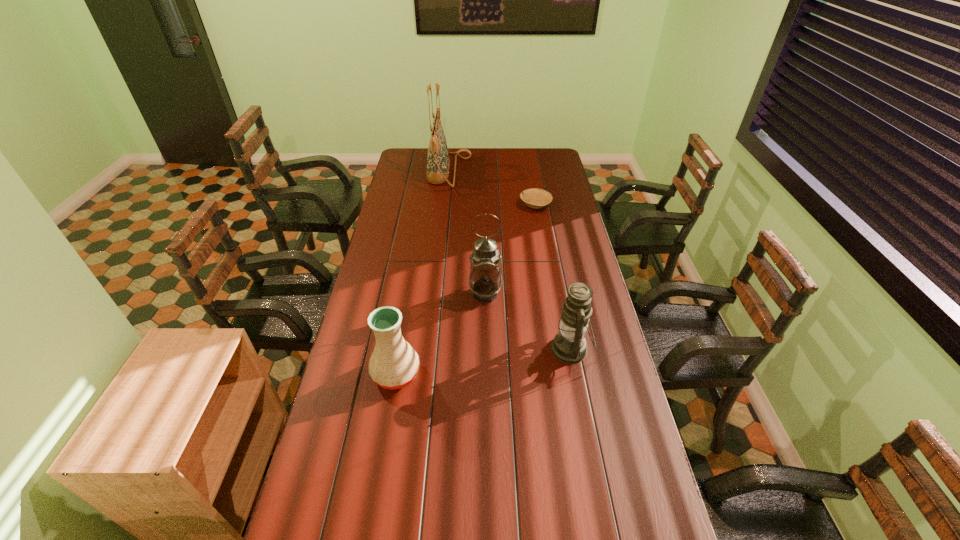
Find the location of `free spot between the farthest object and the fourth nearest object`. free spot between the farthest object and the fourth nearest object is located at coordinates (492, 188).

Identify which object is the fourth closest to the right oil lamp. Please provide its 2D coordinates. Your answer should be formatted as a tuple, i.e. [(x, y)], where the tuple contains the x and y coordinates of a point satisfying the conditions above.

[(438, 163)]

Identify the location of the second closest object relative to the tallest object. The width and height of the screenshot is (960, 540). (485, 280).

Where is `free region that satisfies the following two spatial constraints: 1. on the front-facing side of the tallest object; 2. on the left side of the right oil lamp`? free region that satisfies the following two spatial constraints: 1. on the front-facing side of the tallest object; 2. on the left side of the right oil lamp is located at coordinates (430, 349).

The width and height of the screenshot is (960, 540). What are the coordinates of `vacant space that satisfies the following two spatial constraints: 1. on the front-facing side of the farthest object; 2. on the left side of the taller oil lamp` in the screenshot? It's located at (436, 294).

Find the location of a particular element. free location that satisfies the following two spatial constraints: 1. on the back side of the bowl; 2. on the right side of the pottery is located at coordinates (425, 205).

Identify the location of free region that satisfies the following two spatial constraints: 1. on the front-facing side of the farthest object; 2. on the right side of the shortest object. This screenshot has height=540, width=960. (445, 205).

Identify the location of vacant area in the image that satisfies the following two spatial constraints: 1. on the back side of the pottery; 2. on the left side of the taller oil lamp. Image resolution: width=960 pixels, height=540 pixels. pos(410,294).

Find the location of `free space that satisfies the following two spatial constraints: 1. on the front-facing side of the handbag; 2. on the left side of the nearer oil lamp`. free space that satisfies the following two spatial constraints: 1. on the front-facing side of the handbag; 2. on the left side of the nearer oil lamp is located at coordinates (430, 349).

This screenshot has width=960, height=540. Find the location of `vacant space that satisfies the following two spatial constraints: 1. on the front-facing side of the third object from right to left; 2. on the right side of the handbag`. vacant space that satisfies the following two spatial constraints: 1. on the front-facing side of the third object from right to left; 2. on the right side of the handbag is located at coordinates (436, 294).